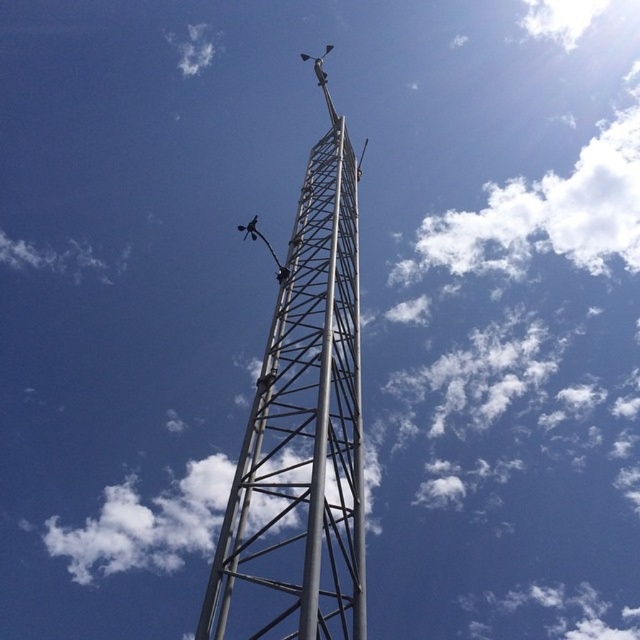
Question: Is silver metallic tower at center to the left of white fluffy cloud at upper center from the viewer's perspective?

Choices:
 (A) no
 (B) yes

Answer: (A)

Question: Among these points, which one is farthest from the camera?

Choices:
 (A) (204, 33)
 (B) (202, 616)

Answer: (A)

Question: Can you confirm if silver metallic tower at center is positioned to the right of white fluffy cloud at upper center?

Choices:
 (A) no
 (B) yes

Answer: (B)

Question: Which point appears closest to the camera in this image?

Choices:
 (A) (184, 68)
 (B) (285, 464)

Answer: (B)

Question: Is silver metallic tower at center to the right of white fluffy cloud at upper center from the viewer's perspective?

Choices:
 (A) yes
 (B) no

Answer: (A)